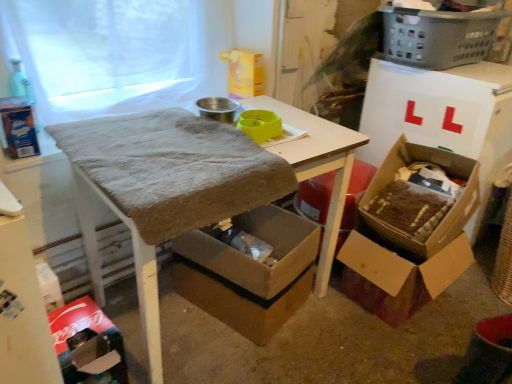
Question: Is white sheer fabric at upper left shorter than textured brown table at center?

Choices:
 (A) no
 (B) yes

Answer: (B)

Question: Does white sheer fabric at upper left contain textured brown table at center?

Choices:
 (A) no
 (B) yes

Answer: (A)

Question: Is white sheer fabric at upper left outside of textured brown table at center?

Choices:
 (A) yes
 (B) no

Answer: (A)

Question: Is white sheer fabric at upper left to the left of textured brown table at center from the viewer's perspective?

Choices:
 (A) no
 (B) yes

Answer: (B)

Question: Is white sheer fabric at upper left to the right of textured brown table at center from the viewer's perspective?

Choices:
 (A) no
 (B) yes

Answer: (A)

Question: From a real-world perspective, is brown cardboard box at lower right, acting as the second box starting from the right, physically located above or below gray plastic laundry basket at upper right?

Choices:
 (A) below
 (B) above

Answer: (A)

Question: Based on their positions, is brown cardboard box at lower right, marked as the 2th box in a left-to-right arrangement, located to the left or right of gray plastic laundry basket at upper right?

Choices:
 (A) left
 (B) right

Answer: (A)

Question: Is brown cardboard box at lower right, marked as the 2th box in a left-to-right arrangement, inside or outside of gray plastic laundry basket at upper right?

Choices:
 (A) inside
 (B) outside

Answer: (B)

Question: Is brown cardboard box at lower right, acting as the second box starting from the right, taller or shorter than gray plastic laundry basket at upper right?

Choices:
 (A) short
 (B) tall

Answer: (B)

Question: In terms of width, does cardboard box at lower left look wider or thinner when compared to cardboard box at right, which is the 1th box in right-to-left order?

Choices:
 (A) thin
 (B) wide

Answer: (A)

Question: Would you say cardboard box at lower left is inside or outside cardboard box at right, the 3th box from the left?

Choices:
 (A) inside
 (B) outside

Answer: (B)

Question: From a real-world perspective, is cardboard box at lower left positioned above or below cardboard box at right, the 3th box from the left?

Choices:
 (A) above
 (B) below

Answer: (B)

Question: Based on their sizes in the image, would you say cardboard box at lower left is bigger or smaller than cardboard box at right, the 3th box from the left?

Choices:
 (A) small
 (B) big

Answer: (A)

Question: Relative to cardboard box at lower center, acting as the first box starting from the left, is white sheer fabric at upper left in front or behind?

Choices:
 (A) front
 (B) behind

Answer: (A)

Question: From the image's perspective, is white sheer fabric at upper left located above or below cardboard box at lower center, acting as the first box starting from the left?

Choices:
 (A) above
 (B) below

Answer: (A)